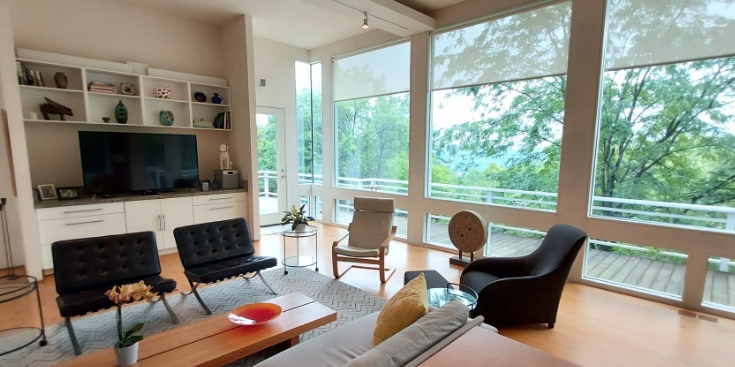
Locate an element on the screen. coffee table is located at coordinates click(x=203, y=333).